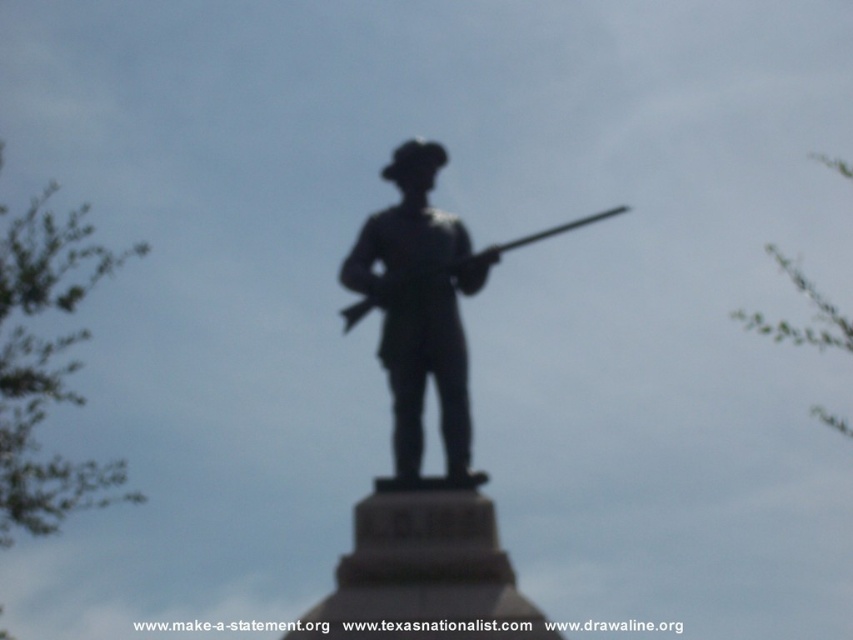
You are a photographer trying to capture the statue and the rifle in the same frame. Since the black metal statue at center and the metallic rifle at center are positioned differently, which object is located to the left in the image?

The black metal statue at center is to the left of the metallic rifle at center according to the description.

You are a photographer trying to capture the black metal statue at center in your shot. The statue is located at coordinates point 0.692, 0.495. You need to adjust your camera to focus on it. What is the exact coordinate point where you should aim your camera to ensure the statue is centered in the frame?

The exact coordinate point to aim your camera is (x=421, y=442) to ensure the black metal statue at center is centered in the frame.